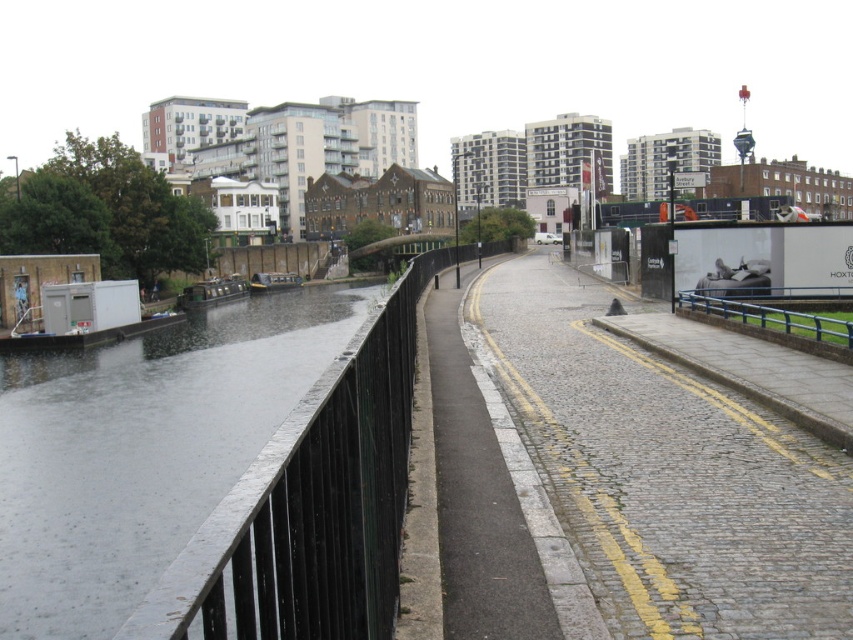
Question: Does black metal water at left have a larger size compared to green matte canal boat at left?

Choices:
 (A) yes
 (B) no

Answer: (A)

Question: Which point is closer to the camera taking this photo?

Choices:
 (A) (216, 301)
 (B) (65, 381)

Answer: (B)

Question: Which of the following is the closest to the observer?

Choices:
 (A) green matte boat at left
 (B) blue metallic rail at right
 (C) black metal water at left

Answer: (C)

Question: Can you confirm if black metal water at left is smaller than blue metallic rail at right?

Choices:
 (A) no
 (B) yes

Answer: (A)

Question: Which of the following is the farthest from the observer?

Choices:
 (A) (202, 301)
 (B) (207, 337)
 (C) (714, 304)

Answer: (A)

Question: Is blue metallic rail at right bigger than green matte boat at left?

Choices:
 (A) yes
 (B) no

Answer: (B)